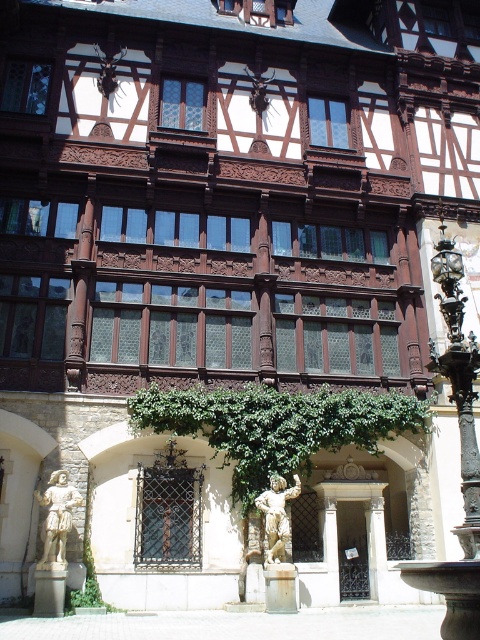
Which is in front, point (67, 513) or point (274, 586)?

Point (67, 513)

Is point (63, 528) positioned in front of point (269, 568)?

Yes, it is in front of point (269, 568).

At what (x,y) coordinates should I click in order to perform the action: click on white stone statue at lower left. Please return your answer as a coordinate pair (x, y). This screenshot has width=480, height=640. Looking at the image, I should click on (57, 515).

In the scene shown: Who is lower down, white stone statue at lower left or stone statue at center?

stone statue at center

Which is in front, point (61, 506) or point (264, 528)?

Positioned in front is point (61, 506).

The image size is (480, 640). What do you see at coordinates (57, 515) in the screenshot? I see `white stone statue at lower left` at bounding box center [57, 515].

Find the location of a particular element. This screenshot has width=480, height=640. white stone statue at lower left is located at coordinates (57, 515).

Can you confirm if smooth stone pillar at lower left is positioned below rustic stone pillar at center?

No.

Is point (58, 577) farther from camera compared to point (269, 609)?

No, it is in front of (269, 609).

The image size is (480, 640). Find the location of `smooth stone pillar at lower left`. smooth stone pillar at lower left is located at coordinates (49, 588).